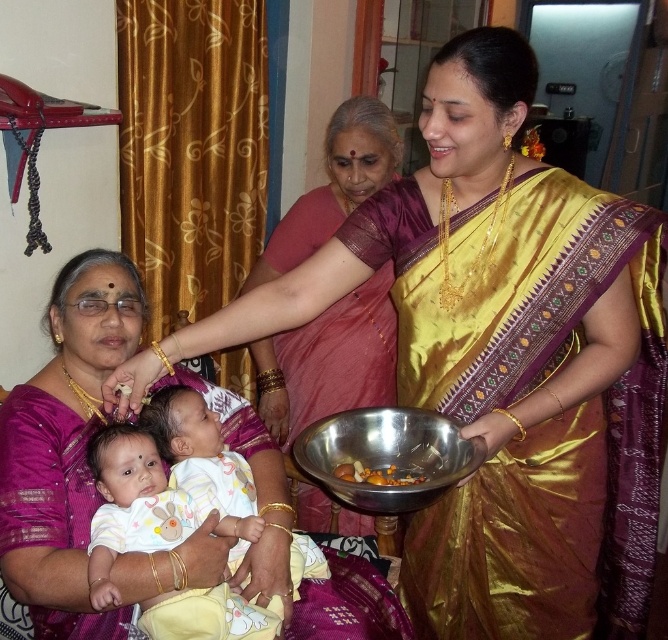
You are a photographer setting up a shoot in this scene. You need to position a small light source to illuminate the white cotton baby at center and the metallic bowl at center. Since the light source can only be placed above one of them, which object should the light be placed above to ensure both receive adequate illumination?

The light source should be placed above the metallic bowl at center because the white cotton baby at center is located below it. This way, the light will naturally illuminate both the bowl and the baby below.

In the domestic scene described, there are a white cotton baby at center and a metallic bowl at center. From the perspective of someone looking at the image, which object is closer to the viewer?

The white cotton baby at center is in front of the metallic bowl at center, so it is closer to the viewer.